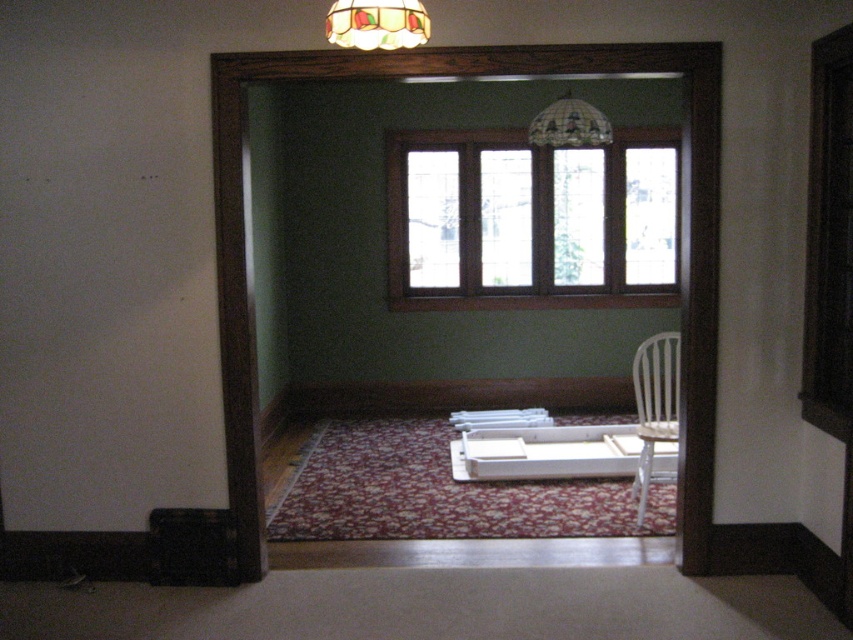
Question: Which of the following is the farthest from the observer?

Choices:
 (A) (398, 145)
 (B) (531, 141)

Answer: (A)

Question: Is white plastic chair at center above stained glass lampshade at upper center?

Choices:
 (A) yes
 (B) no

Answer: (B)

Question: Which object appears closest to the camera in this image?

Choices:
 (A) clear glass window at center
 (B) stained glass dome at upper center

Answer: (B)

Question: Which of these objects is positioned closest to the white plastic chair at center?

Choices:
 (A) stained glass lampshade at upper center
 (B) clear glass window at center

Answer: (B)

Question: Is stained glass lampshade at upper center above stained glass dome at upper center?

Choices:
 (A) yes
 (B) no

Answer: (B)

Question: Is stained glass lampshade at upper center wider than stained glass dome at upper center?

Choices:
 (A) no
 (B) yes

Answer: (A)